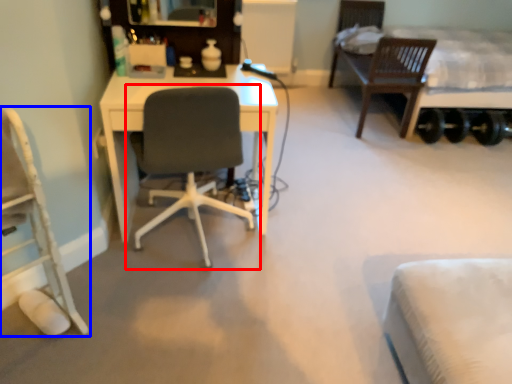
Question: Which of the following is the closest to the observer, chair (highlighted by a red box) or chair (highlighted by a blue box)?

Choices:
 (A) chair
 (B) chair

Answer: (B)